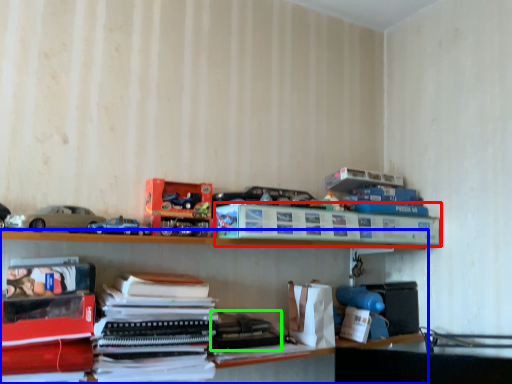
Question: Based on their relative distances, which object is nearer to paperback book (highlighted by a red box)? Choose from shelf (highlighted by a blue box) and book (highlighted by a green box).

Choices:
 (A) shelf
 (B) book

Answer: (A)